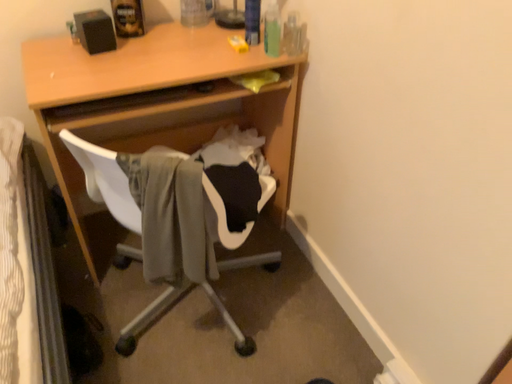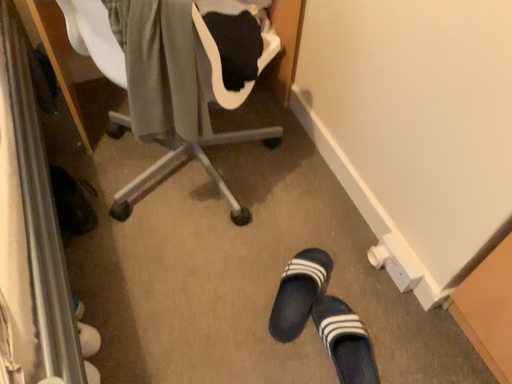
Question: How did the camera likely rotate when shooting the video?

Choices:
 (A) rotated downward
 (B) rotated upward

Answer: (A)